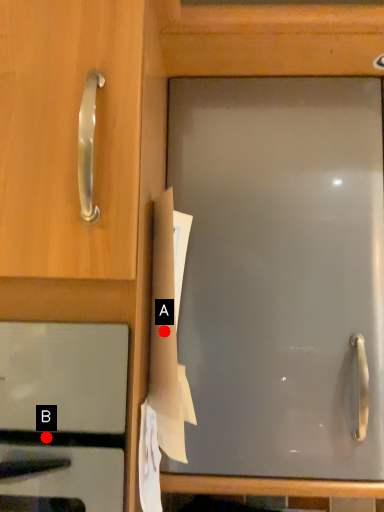
Question: Two points are circled on the image, labeled by A and B beside each circle. Among these points, which one is farthest from the camera?

Choices:
 (A) A is further
 (B) B is further

Answer: (A)